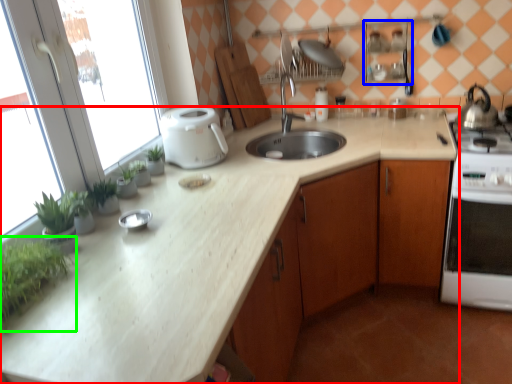
Question: Based on their relative distances, which object is farther from countertop (highlighted by a red box)? Choose from shelf (highlighted by a blue box) and plant (highlighted by a green box).

Choices:
 (A) shelf
 (B) plant

Answer: (A)